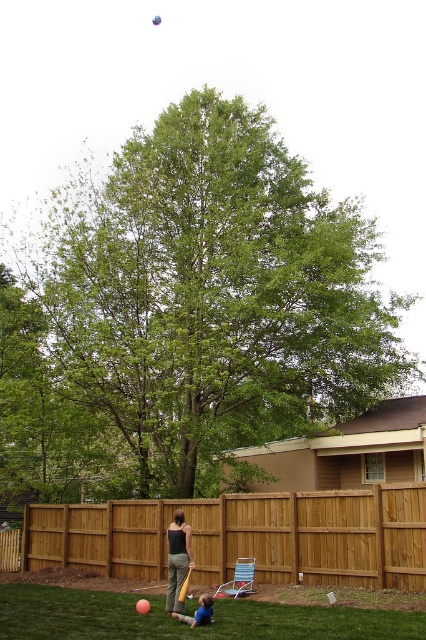
Does green leafy tree at center have a greater height compared to blue fabric shirt at lower center?

Indeed, green leafy tree at center has a greater height compared to blue fabric shirt at lower center.

Between point (340, 284) and point (201, 620), which one is positioned behind?

The point (340, 284) is behind.

In order to click on green leafy tree at center in this screenshot , I will do `click(189, 312)`.

Who is lower down, dark green fabric pants at center or blue fabric shirt at lower center?

blue fabric shirt at lower center

Does dark green fabric pants at center have a lesser height compared to blue fabric shirt at lower center?

Incorrect, dark green fabric pants at center's height does not fall short of blue fabric shirt at lower center's.

What do you see at coordinates (178, 560) in the screenshot?
I see `dark green fabric pants at center` at bounding box center [178, 560].

The image size is (426, 640). I want to click on dark green fabric pants at center, so click(178, 560).

Who is more forward, (166, 243) or (178, 596)?

Point (178, 596) is in front.

Locate an element on the screen. The width and height of the screenshot is (426, 640). green leafy tree at center is located at coordinates (189, 312).